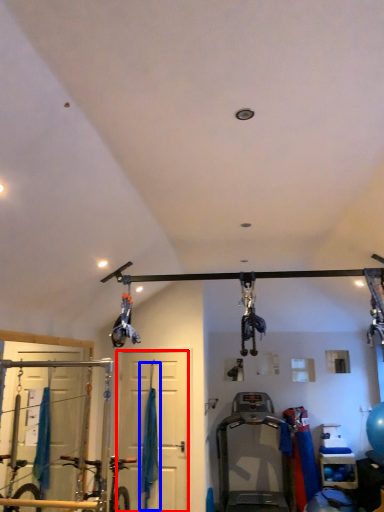
Question: Which object appears closest to the camera in this image, door (highlighted by a red box) or curtain (highlighted by a blue box)?

Choices:
 (A) door
 (B) curtain

Answer: (B)